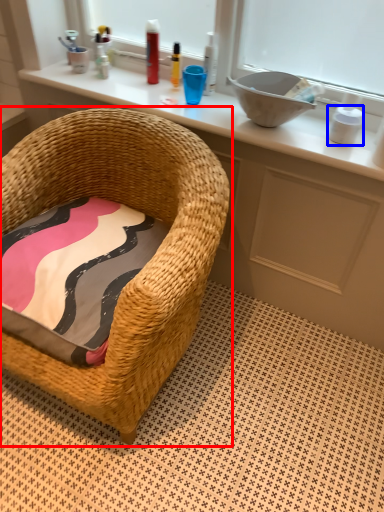
Question: Which of the following is the farthest to the observer, chair (highlighted by a red box) or toiletry (highlighted by a blue box)?

Choices:
 (A) chair
 (B) toiletry

Answer: (B)